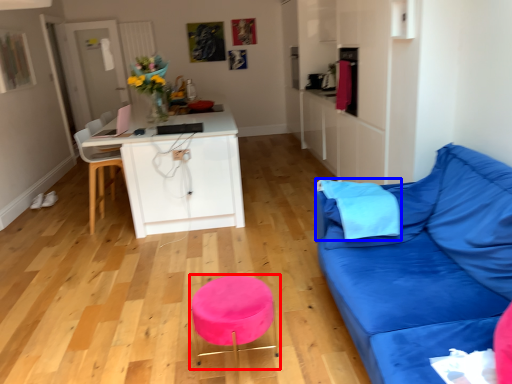
Question: Among these objects, which one is nearest to the camera, bar stool (highlighted by a red box) or pillow (highlighted by a blue box)?

Choices:
 (A) bar stool
 (B) pillow

Answer: (A)